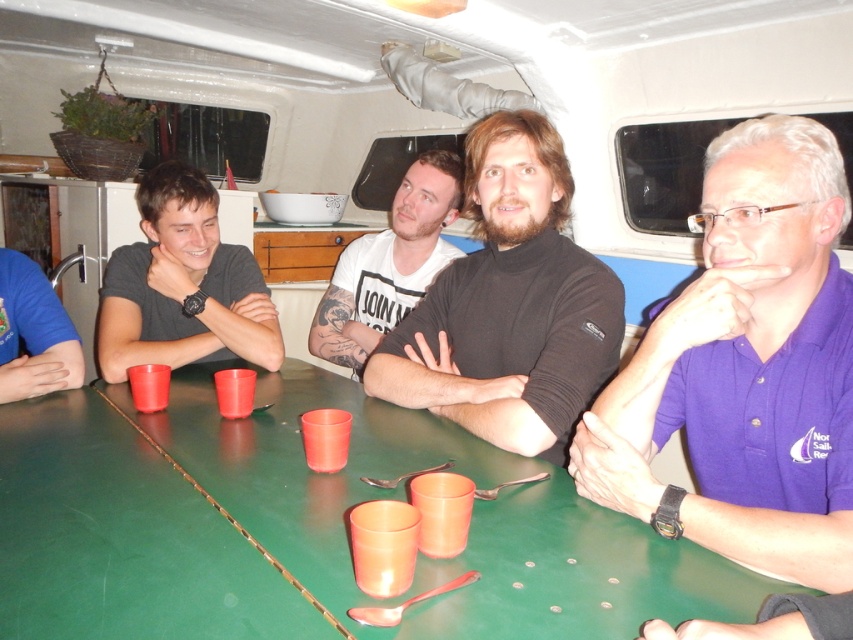
Does black matte turtleneck at center have a larger size compared to matte plastic cup at table left?

Yes.

Does black matte turtleneck at center appear over matte plastic cup at table left?

Yes.

Who is more forward, (519, 228) or (143, 404)?

Point (519, 228)

What are the coordinates of `black matte turtleneck at center` in the screenshot? It's located at (509, 305).

Which is more to the right, green plastic table at center or matte plastic cup at table left?

green plastic table at center

Is green plastic table at center above matte plastic cup at table left?

No, green plastic table at center is not above matte plastic cup at table left.

Describe the element at coordinates (305, 525) in the screenshot. I see `green plastic table at center` at that location.

The width and height of the screenshot is (853, 640). I want to click on green plastic table at center, so click(x=305, y=525).

Consider the image. Does matte black shirt at left appear on the left side of translucent plastic cup at center?

Yes, matte black shirt at left is to the left of translucent plastic cup at center.

Based on the photo, measure the distance between matte black shirt at left and camera.

matte black shirt at left and camera are 6.01 feet apart from each other.

You are a GUI agent. You are given a task and a screenshot of the screen. Output one action in this format:
    pyautogui.click(x=<x>, y=<y>)
    Task: Click on the matte black shirt at left
    This screenshot has height=640, width=853.
    Given the screenshot: What is the action you would take?
    pyautogui.click(x=183, y=285)